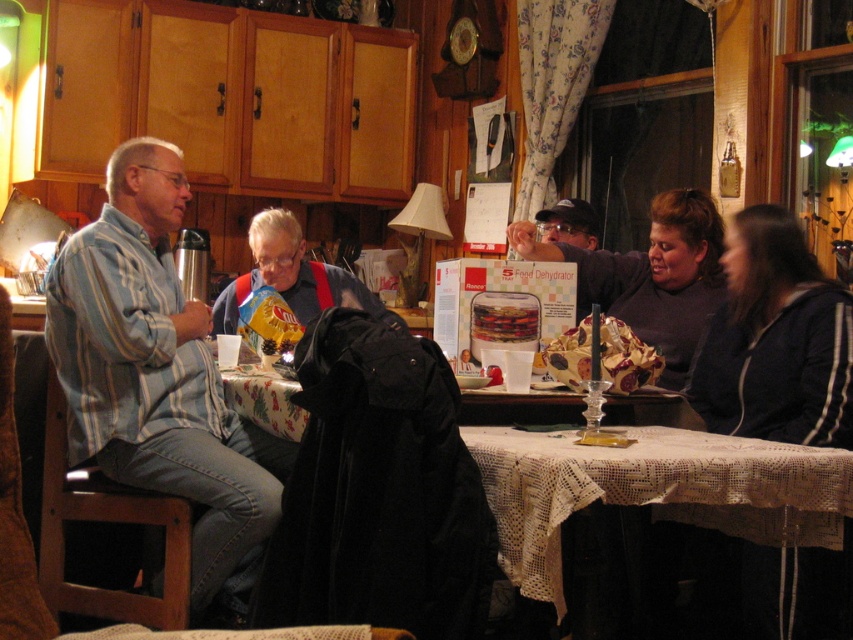
Question: Which object is closer to the camera taking this photo?

Choices:
 (A) striped cotton shirt at left
 (B) white lace tablecloth at lower right

Answer: (B)

Question: Is striped cotton shirt at left closer to camera compared to matte black cap at upper center?

Choices:
 (A) yes
 (B) no

Answer: (A)

Question: Among these points, which one is farthest from the camera?

Choices:
 (A) (659, 344)
 (B) (573, 461)

Answer: (A)

Question: Is striped cotton shirt at left wider than denim jacket at center?

Choices:
 (A) no
 (B) yes

Answer: (A)

Question: Does white lace tablecloth at lower right have a greater width compared to dark gray sweater at center?

Choices:
 (A) yes
 (B) no

Answer: (A)

Question: Among these points, which one is farthest from the camera?

Choices:
 (A) (589, 241)
 (B) (705, 324)
 (C) (277, 232)
 (D) (160, 458)

Answer: (A)